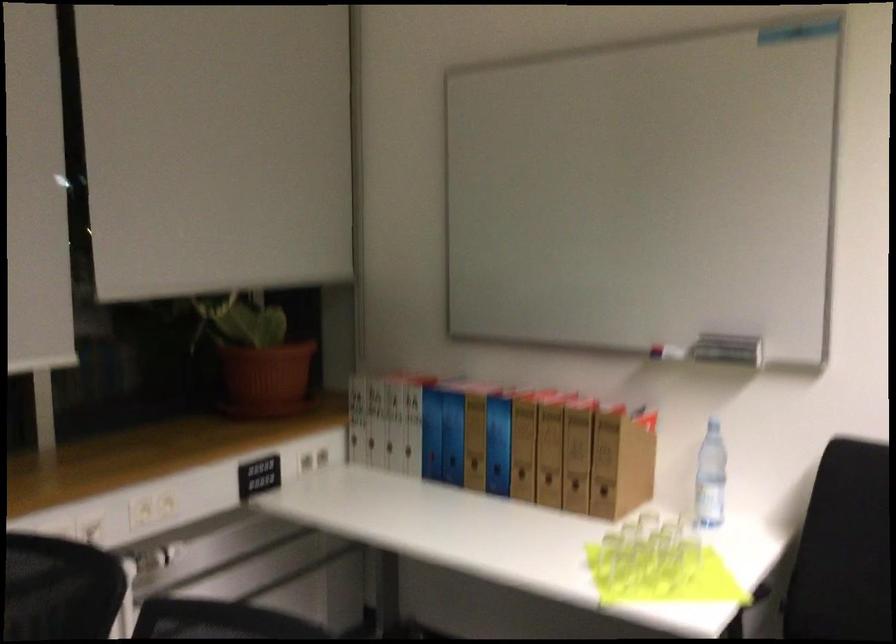
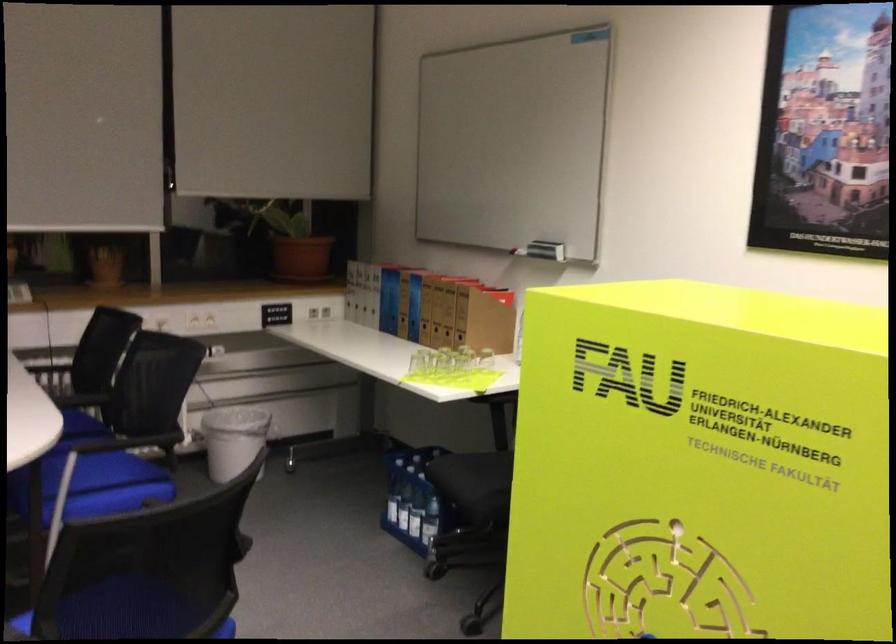
Locate, in the second image, the point that corresponds to the point at 730,355 in the first image.

(546, 250)